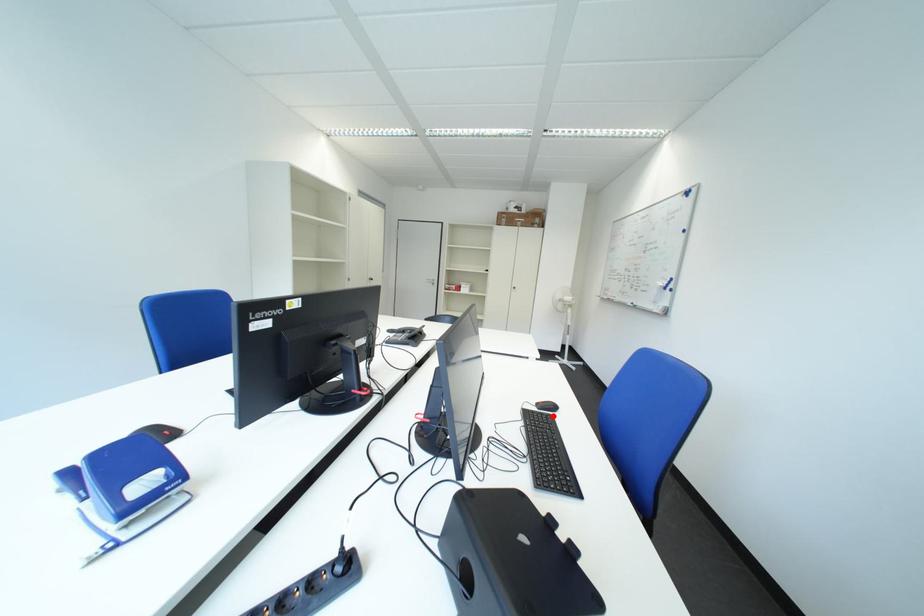
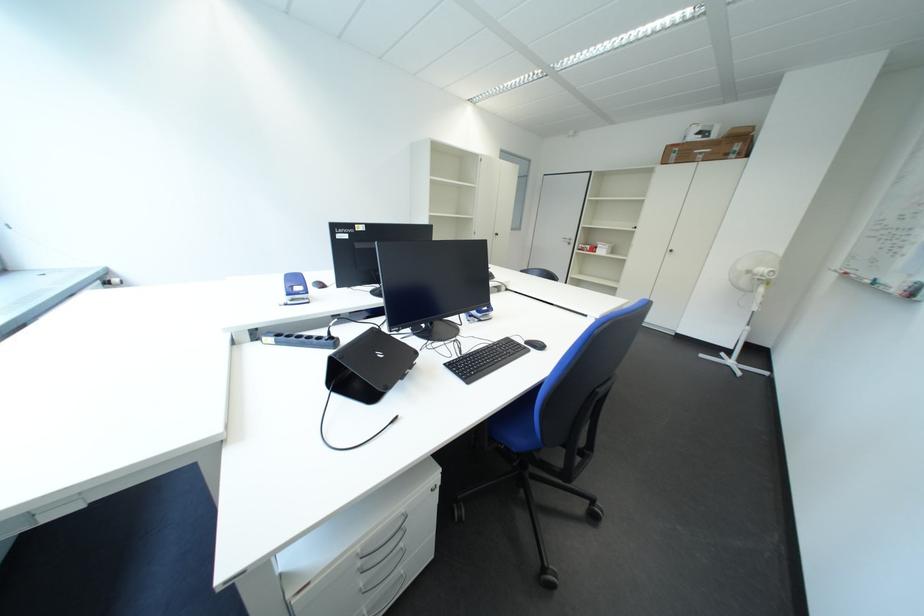
Where in the second image is the point corresponding to the highlighted location from the first image?

(531, 347)